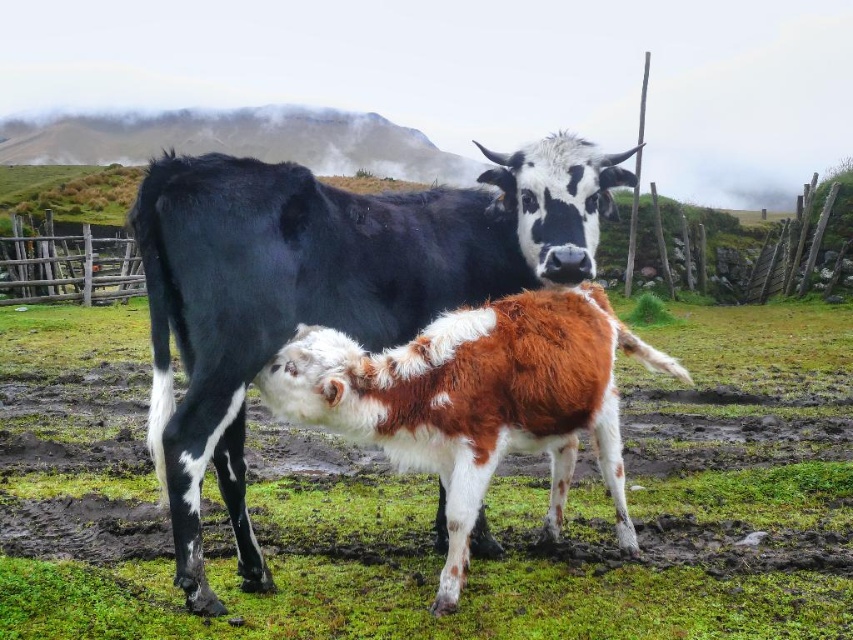
Between black and white cow at center and wooden fence at left, which one appears on the left side from the viewer's perspective?

wooden fence at left

Does black and white cow at center have a smaller size compared to wooden fence at left?

Yes, black and white cow at center is smaller than wooden fence at left.

Which is in front, point (221, 452) or point (10, 228)?

Point (221, 452) is more forward.

You are a GUI agent. You are given a task and a screenshot of the screen. Output one action in this format:
    pyautogui.click(x=<x>, y=<y>)
    Task: Click on the black and white cow at center
    The height and width of the screenshot is (640, 853).
    Given the screenshot: What is the action you would take?
    pyautogui.click(x=326, y=289)

Between brown fuzzy calf at center and wooden fence at left, which one appears on the left side from the viewer's perspective?

wooden fence at left

In the scene shown: Does brown fuzzy calf at center have a larger size compared to wooden fence at left?

Yes, brown fuzzy calf at center is bigger than wooden fence at left.

Where is `brown fuzzy calf at center`? The width and height of the screenshot is (853, 640). brown fuzzy calf at center is located at coordinates (434, 497).

Where is `brown fuzzy calf at center`? brown fuzzy calf at center is located at coordinates [434, 497].

Who is higher up, brown fuzzy calf at center or black and white cow at center?

black and white cow at center is higher up.

Between brown fuzzy calf at center and black and white cow at center, which one appears on the left side from the viewer's perspective?

From the viewer's perspective, black and white cow at center appears more on the left side.

Where is `brown fuzzy calf at center`? This screenshot has width=853, height=640. brown fuzzy calf at center is located at coordinates (434, 497).

At what (x,y) coordinates should I click in order to perform the action: click on brown fuzzy calf at center. Please return your answer as a coordinate pair (x, y). The height and width of the screenshot is (640, 853). Looking at the image, I should click on (434, 497).